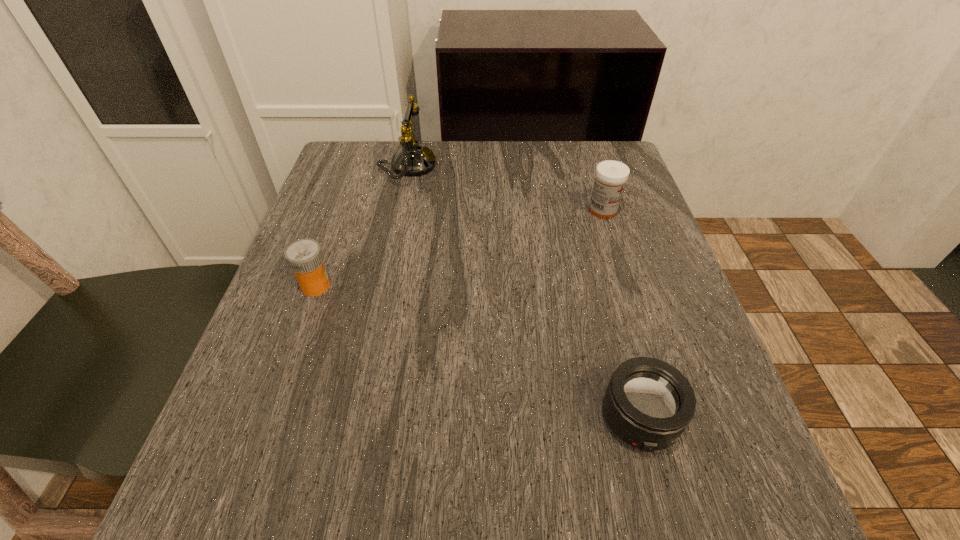
The height and width of the screenshot is (540, 960). Find the location of `the second object from left to right`. the second object from left to right is located at coordinates (412, 159).

I want to click on the tallest object, so click(412, 159).

Where is `the right medicine`? This screenshot has width=960, height=540. the right medicine is located at coordinates (611, 176).

Find the location of a particular element. This screenshot has width=960, height=540. the taller medicine is located at coordinates (611, 176).

This screenshot has width=960, height=540. I want to click on the second shortest object, so click(x=304, y=257).

The image size is (960, 540). What are the coordinates of `the shorter medicine` in the screenshot? It's located at (304, 257).

Find the location of a particular element. telephoto lens is located at coordinates click(x=648, y=403).

Where is `the nearest object`? This screenshot has width=960, height=540. the nearest object is located at coordinates (648, 403).

At what (x,y) coordinates should I click in order to perform the action: click on vacant space located 0.070m on the dial of the second object from left to right. Please return your answer as a coordinate pair (x, y). The image size is (960, 540). Looking at the image, I should click on (464, 166).

Locate an element on the screen. free space located 0.230m on the left of the farther medicine is located at coordinates (485, 211).